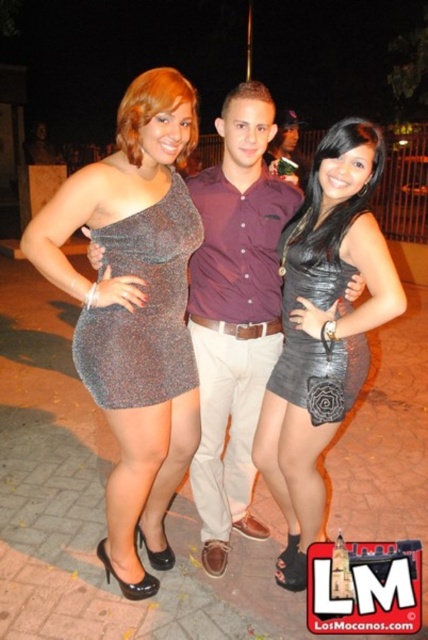
You are a photographer trying to capture a clear photo of the sparkly metallic dress at center and the sparkly metallic dress at left. Since both dresses are sparkly, you need to adjust your camera focus. Which dress should you focus on first to ensure it appears sharp in the photo?

The sparkly metallic dress at center is in front of the sparkly metallic dress at left, so focusing on the sparkly metallic dress at center first will ensure it appears sharp while the background dress may be slightly blurred.

You are a photographer trying to capture a photo of both the sparkly metallic dress at center and the black leather dress at center. Since you want to ensure both are visible in the frame, which direction should you position yourself relative to the subjects to capture both dresses in the shot?

You should position yourself to the right of the subjects because the sparkly metallic dress at center is to the left of the black leather dress at center, so facing towards the right side will allow both dresses to be in the frame.